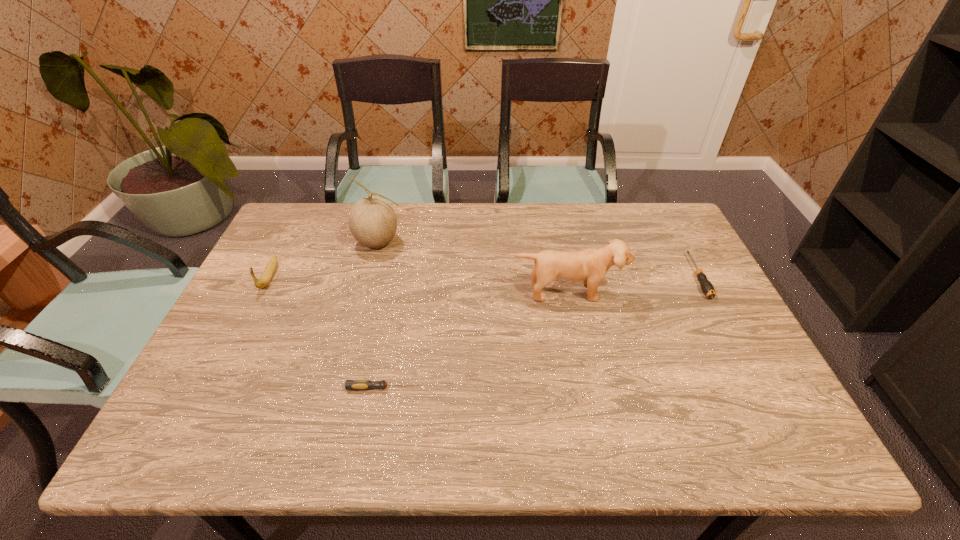
You are a GUI agent. You are given a task and a screenshot of the screen. Output one action in this format:
    pyautogui.click(x=<x>, y=<y>)
    Task: Click on the cantaloup
    
    Given the screenshot: What is the action you would take?
    pyautogui.click(x=372, y=221)

Identify the location of puppy. (591, 265).

In order to click on banana in this screenshot , I will do `click(267, 275)`.

Locate an element on the screen. the third tallest object is located at coordinates (267, 275).

This screenshot has width=960, height=540. In order to click on the taller screwdriver in this screenshot , I will do `click(707, 288)`.

Locate an element on the screen. This screenshot has width=960, height=540. the right screwdriver is located at coordinates (707, 288).

Locate an element on the screen. This screenshot has width=960, height=540. the nearest object is located at coordinates (349, 384).

This screenshot has height=540, width=960. I want to click on the shorter screwdriver, so click(x=349, y=384).

The width and height of the screenshot is (960, 540). In order to click on vacant region located 0.070m on the right of the cantaloup in this screenshot , I will do `click(425, 242)`.

The height and width of the screenshot is (540, 960). In order to click on vacant area situated 0.310m on the left side of the second object from right to left in this screenshot , I will do coord(588,406).